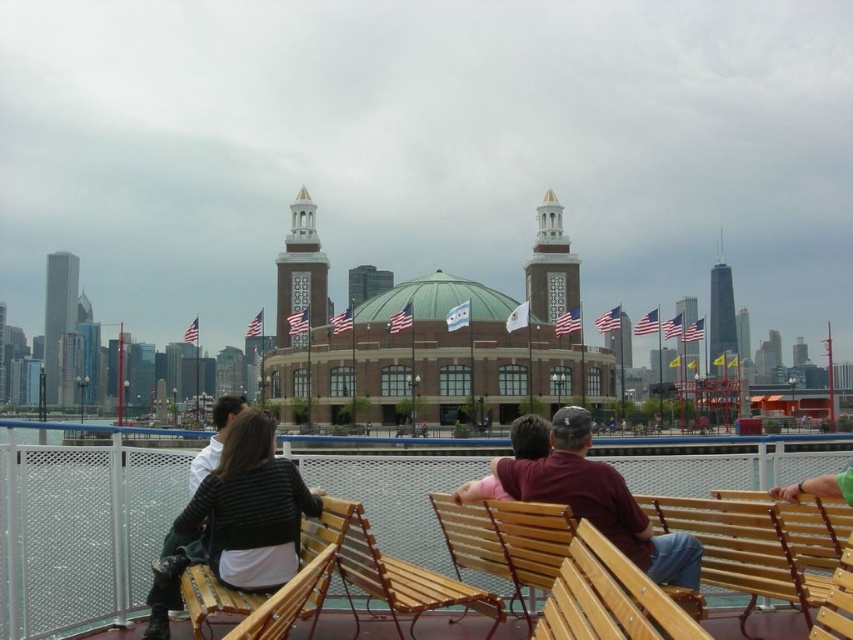
Is point (328, 259) more distant than point (718, 278)?

No, (328, 259) is in front of (718, 278).

Does matte brick tower at center have a greater width compared to shiny glass skyscraper at center right?

Yes, matte brick tower at center is wider than shiny glass skyscraper at center right.

Is point (305, 220) farther from camera compared to point (714, 365)?

Yes, point (305, 220) is behind point (714, 365).

The image size is (853, 640). I want to click on matte brick tower at center, so [300, 273].

Measure the distance between striped sweater at center and camera.

striped sweater at center is 58.61 meters from camera.

Where is `striped sweater at center`? The image size is (853, 640). striped sweater at center is located at coordinates (236, 520).

Is shiny glass skyscraper at left bigger than shiny glass skyscraper at center right?

No, shiny glass skyscraper at left is not bigger than shiny glass skyscraper at center right.

Is point (45, 355) positioned behind point (727, 320)?

Yes.

You are a GUI agent. You are given a task and a screenshot of the screen. Output one action in this format:
    pyautogui.click(x=<x>, y=<y>)
    Task: Click on the shiny glass skyscraper at left
    
    Given the screenshot: What is the action you would take?
    pyautogui.click(x=57, y=314)